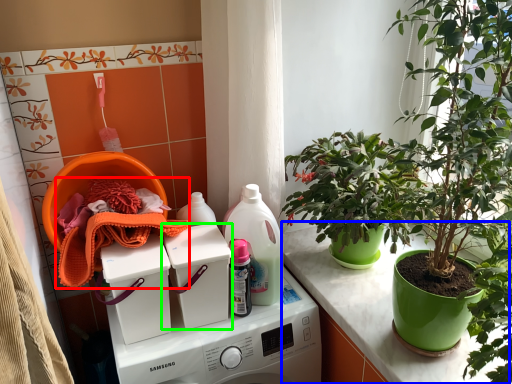
Question: Based on their relative distances, which object is nearer to material (highlighted by a red box)? Choose from counter (highlighted by a blue box) and washing machine (highlighted by a green box).

Choices:
 (A) counter
 (B) washing machine

Answer: (B)